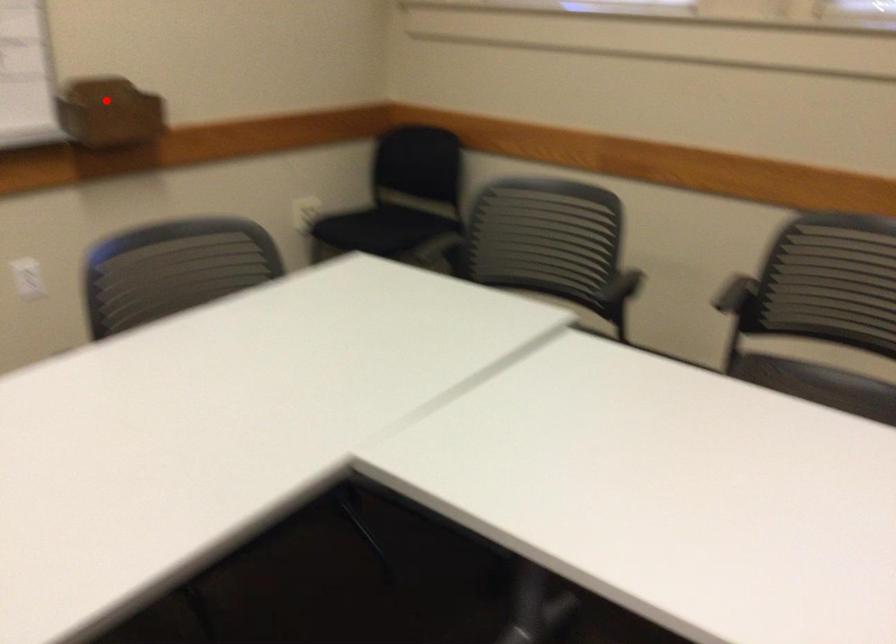
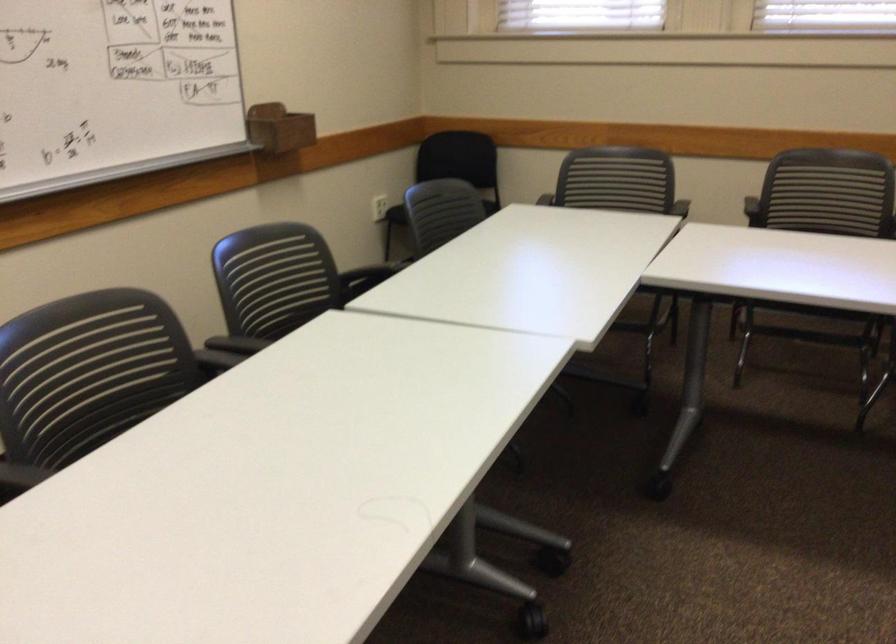
Question: I am providing you with two images of the same scene from different viewpoints. In image1, a red point is highlighted. Considering the same 3D point in image2, which of the following is correct?

Choices:
 (A) It is closer
 (B) It is farther

Answer: (B)